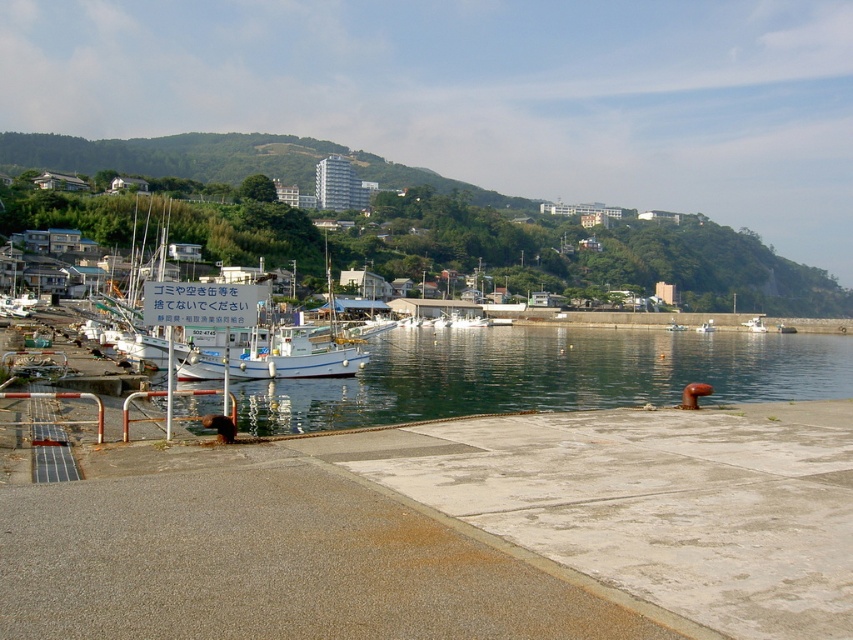
You are standing on the dock and see the clear water at dock center and the green grassy hillside at upper center. Which object is positioned to the left of the other?

The clear water at dock center is to the left of the green grassy hillside at upper center.